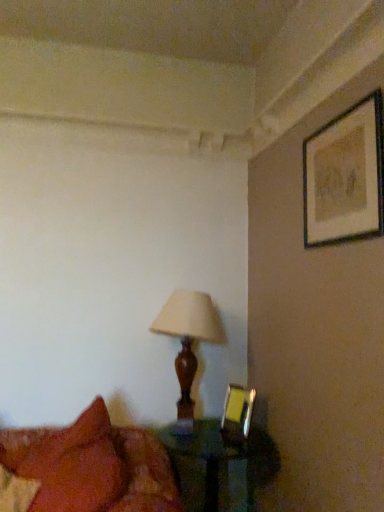
The width and height of the screenshot is (384, 512). Describe the element at coordinates (345, 176) in the screenshot. I see `matte black picture frame at upper right, the 1th picture frame when ordered from top to bottom` at that location.

Locate an element on the screen. The image size is (384, 512). matte black picture frame at upper right, which is counted as the second picture frame, starting from the bottom is located at coordinates (345, 176).

The height and width of the screenshot is (512, 384). Describe the element at coordinates (86, 468) in the screenshot. I see `velvet red pillow at lower left` at that location.

The height and width of the screenshot is (512, 384). Find the location of `matte black picture frame at upper right, the 1th picture frame when ordered from top to bottom`. matte black picture frame at upper right, the 1th picture frame when ordered from top to bottom is located at coordinates (345, 176).

How many degrees apart are the facing directions of velvet red pillow at lower left and metallic gold picture frame at lower right, which ranks as the second picture frame in front-to-back order?

5.65 degrees separate the facing orientations of velvet red pillow at lower left and metallic gold picture frame at lower right, which ranks as the second picture frame in front-to-back order.

I want to click on the 1st picture frame to the right when counting from the velvet red pillow at lower left, so click(237, 413).

Could you tell me if velvet red pillow at lower left is facing metallic gold picture frame at lower right, placed as the first picture frame when sorted from left to right?

No, velvet red pillow at lower left is not oriented towards metallic gold picture frame at lower right, placed as the first picture frame when sorted from left to right.

From their relative heights in the image, would you say velvet red pillow at lower left is taller or shorter than metallic gold picture frame at lower right, the first picture frame from the back?

In the image, velvet red pillow at lower left appears to be taller than metallic gold picture frame at lower right, the first picture frame from the back.

Find the location of `bed located above the translucent glass table at lower center (from the image's perspective)`. bed located above the translucent glass table at lower center (from the image's perspective) is located at coordinates (86, 468).

Is translucent glass table at lower center taller than velvet red pillow at lower left?

Incorrect, the height of translucent glass table at lower center is not larger of that of velvet red pillow at lower left.

How many degrees apart are the facing directions of translucent glass table at lower center and velvet red pillow at lower left?

The angular difference between translucent glass table at lower center and velvet red pillow at lower left is 61.1 degrees.

Can you confirm if translucent glass table at lower center is bigger than velvet red pillow at lower left?

Incorrect, translucent glass table at lower center is not larger than velvet red pillow at lower left.

Who is smaller, translucent glass table at lower center or matte black picture frame at upper right, which is the 2th picture frame in back-to-front order?

matte black picture frame at upper right, which is the 2th picture frame in back-to-front order.

From a real-world perspective, is translucent glass table at lower center physically located above or below matte black picture frame at upper right, which is counted as the second picture frame, starting from the bottom?

Clearly, from a real-world perspective, translucent glass table at lower center is below matte black picture frame at upper right, which is counted as the second picture frame, starting from the bottom.

Is translucent glass table at lower center inside the boundaries of matte black picture frame at upper right, the 1th picture frame when ordered from top to bottom, or outside?

translucent glass table at lower center is spatially situated outside matte black picture frame at upper right, the 1th picture frame when ordered from top to bottom.

Consider the image. Between wooden lampshade at center and velvet red pillow at lower left, which one has larger width?

Wider between the two is velvet red pillow at lower left.

Can you tell me how much wooden lampshade at center and velvet red pillow at lower left differ in facing direction?

61.1 degrees.

Is point (170, 325) more distant than point (58, 450)?

Yes, it is.

Is wooden lampshade at center looking in the opposite direction of translucent glass table at lower center?

wooden lampshade at center does not have its back to translucent glass table at lower center.

From a real-world perspective, which object stands above the other?

wooden lampshade at center is physically above.

Is wooden lampshade at center closer to the viewer compared to translucent glass table at lower center?

No, the depth of wooden lampshade at center is greater than that of translucent glass table at lower center.

How many degrees apart are the facing directions of wooden lampshade at center and matte black picture frame at upper right, the 1th picture frame when ordered from top to bottom?

They differ by 88.8 degrees in their facing directions.

Looking at this image, would you say matte black picture frame at upper right, acting as the 2th picture frame starting from the left, is part of wooden lampshade at center's contents?

No, matte black picture frame at upper right, acting as the 2th picture frame starting from the left, is located outside of wooden lampshade at center.

At what (x,y) coordinates should I click in order to perform the action: click on picture frame in front of the wooden lampshade at center. Please return your answer as a coordinate pair (x, y). Looking at the image, I should click on (x=345, y=176).

Can you confirm if matte black picture frame at upper right, acting as the 2th picture frame starting from the left, is bigger than translucent glass table at lower center?

No.

From the picture: Can you confirm if matte black picture frame at upper right, marked as the first picture frame in a front-to-back arrangement, is wider than translucent glass table at lower center?

Incorrect, the width of matte black picture frame at upper right, marked as the first picture frame in a front-to-back arrangement, does not surpass that of translucent glass table at lower center.

You are a GUI agent. You are given a task and a screenshot of the screen. Output one action in this format:
    pyautogui.click(x=<x>, y=<y>)
    Task: Click on the table lying behind the matte black picture frame at upper right, which is the 2th picture frame in back-to-front order
    The image size is (384, 512).
    Given the screenshot: What is the action you would take?
    pyautogui.click(x=208, y=467)

Based on the photo, is matte black picture frame at upper right, the 1th picture frame when ordered from top to bottom, shorter than translucent glass table at lower center?

Yes.

From a real-world perspective, which picture frame is the 1st one above the velvet red pillow at lower left? Please provide its 2D coordinates.

[(237, 413)]

Locate an element on the screen. The height and width of the screenshot is (512, 384). table that is on the right side of velvet red pillow at lower left is located at coordinates (208, 467).

When comparing their distances from metallic gold picture frame at lower right, the first picture frame positioned from the bottom, does velvet red pillow at lower left or translucent glass table at lower center seem closer?

Based on the image, translucent glass table at lower center appears to be nearer to metallic gold picture frame at lower right, the first picture frame positioned from the bottom.

Which object lies further to the anchor point velvet red pillow at lower left, metallic gold picture frame at lower right, which ranks as the second picture frame in front-to-back order, or translucent glass table at lower center?

metallic gold picture frame at lower right, which ranks as the second picture frame in front-to-back order.

Based on their spatial positions, is matte black picture frame at upper right, acting as the 2th picture frame starting from the left, or velvet red pillow at lower left further from wooden lampshade at center?

matte black picture frame at upper right, acting as the 2th picture frame starting from the left, is positioned further to the anchor wooden lampshade at center.

From the image, which object appears to be farther from velvet red pillow at lower left, wooden lampshade at center or metallic gold picture frame at lower right, the second picture frame from the top?

The object further to velvet red pillow at lower left is metallic gold picture frame at lower right, the second picture frame from the top.

Looking at the image, which one is located closer to wooden lampshade at center, translucent glass table at lower center or metallic gold picture frame at lower right, placed as the first picture frame when sorted from left to right?

Among the two, metallic gold picture frame at lower right, placed as the first picture frame when sorted from left to right, is located nearer to wooden lampshade at center.

Considering their positions, is matte black picture frame at upper right, the first picture frame viewed from the right, positioned closer to translucent glass table at lower center than velvet red pillow at lower left?

velvet red pillow at lower left is positioned closer to the anchor translucent glass table at lower center.

From the image, which object appears to be farther from wooden lampshade at center, translucent glass table at lower center or matte black picture frame at upper right, marked as the first picture frame in a front-to-back arrangement?

Among the two, matte black picture frame at upper right, marked as the first picture frame in a front-to-back arrangement, is located further to wooden lampshade at center.

Looking at the image, which one is located further to wooden lampshade at center, metallic gold picture frame at lower right, the first picture frame from the back, or translucent glass table at lower center?

translucent glass table at lower center is further to wooden lampshade at center.

What are the coordinates of `bed between matte black picture frame at upper right, marked as the first picture frame in a front-to-back arrangement, and translucent glass table at lower center, in the vertical direction` in the screenshot? It's located at (86, 468).

You are a GUI agent. You are given a task and a screenshot of the screen. Output one action in this format:
    pyautogui.click(x=<x>, y=<y>)
    Task: Click on the table positioned between velvet red pillow at lower left and wooden lampshade at center from near to far
    The width and height of the screenshot is (384, 512).
    Given the screenshot: What is the action you would take?
    pyautogui.click(x=208, y=467)

Where is `picture frame between wooden lampshade at center and translucent glass table at lower center vertically`? This screenshot has height=512, width=384. picture frame between wooden lampshade at center and translucent glass table at lower center vertically is located at coordinates (237, 413).

You are a GUI agent. You are given a task and a screenshot of the screen. Output one action in this format:
    pyautogui.click(x=<x>, y=<y>)
    Task: Click on the picture frame between matte black picture frame at upper right, marked as the first picture frame in a front-to-back arrangement, and velvet red pillow at lower left in the up-down direction
    The image size is (384, 512).
    Given the screenshot: What is the action you would take?
    pyautogui.click(x=237, y=413)